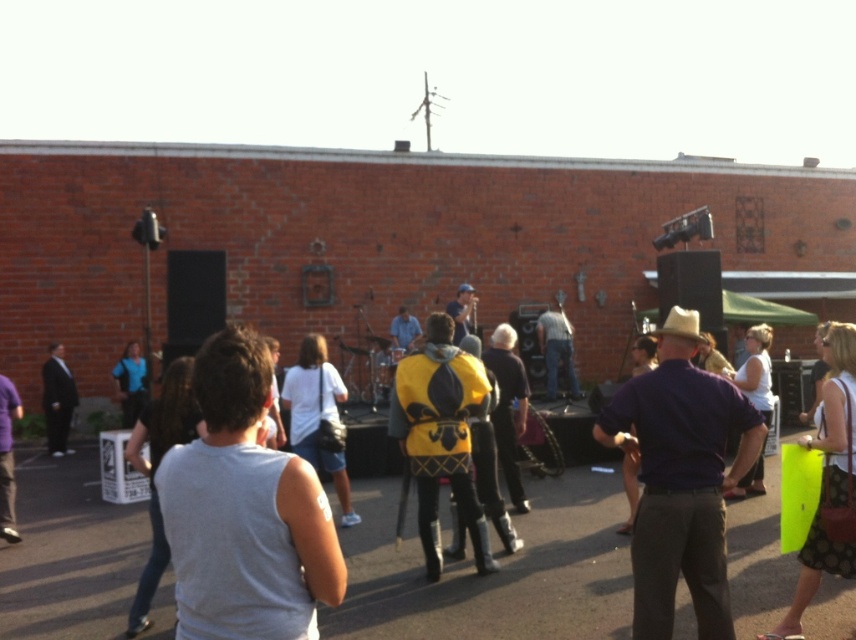
Does purple cotton shirt at center have a larger size compared to neon yellow paper at lower right?

No, purple cotton shirt at center is not bigger than neon yellow paper at lower right.

The image size is (856, 640). Describe the element at coordinates (681, 477) in the screenshot. I see `purple cotton shirt at center` at that location.

Is point (652, 436) positioned before point (779, 621)?

Yes, point (652, 436) is closer to viewer.

The height and width of the screenshot is (640, 856). What are the coordinates of `purple cotton shirt at center` in the screenshot? It's located at (681, 477).

Does purple cotton shirt at center have a greater width compared to matte black suit at left?

Yes.

Who is positioned more to the left, purple cotton shirt at center or matte black suit at left?

matte black suit at left is more to the left.

I want to click on purple cotton shirt at center, so click(681, 477).

Can you confirm if neon yellow paper at lower right is taller than matte black suit at left?

Yes, neon yellow paper at lower right is taller than matte black suit at left.

I want to click on neon yellow paper at lower right, so click(828, 481).

Is point (835, 460) in front of point (61, 448)?

Yes, it is.

Locate an element on the screen. neon yellow paper at lower right is located at coordinates (828, 481).